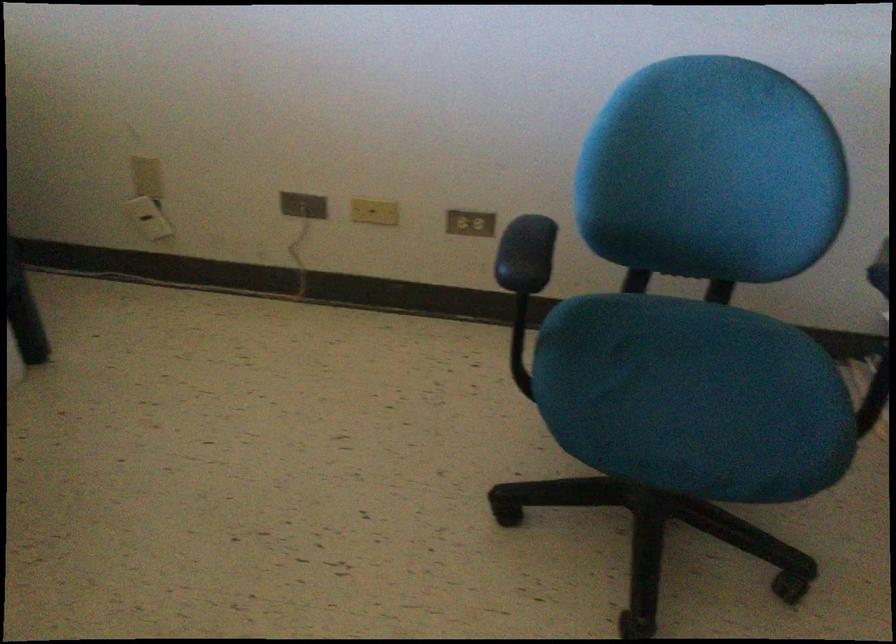
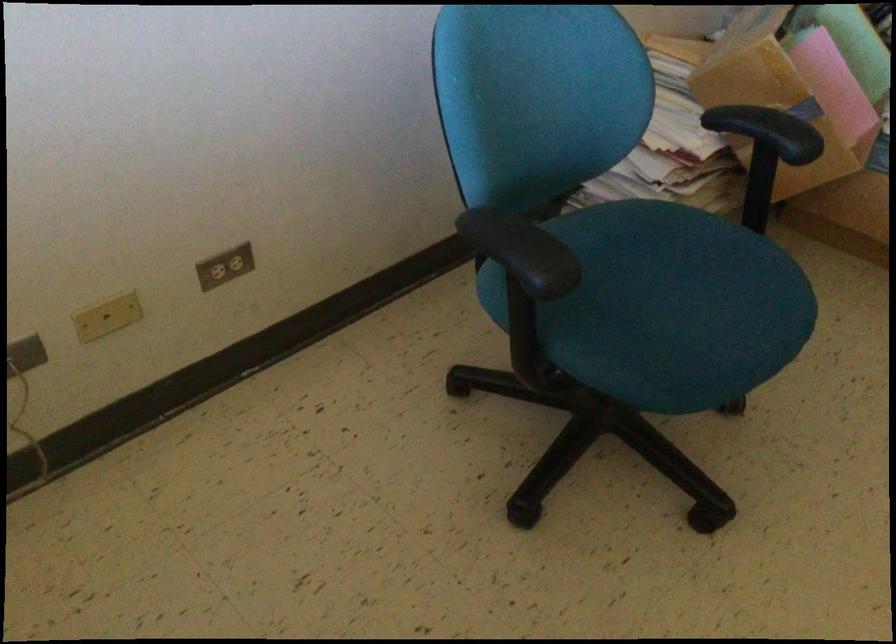
The first image is from the beginning of the video and the second image is from the end. How did the camera likely rotate when shooting the video?

The camera rotated toward right-down.